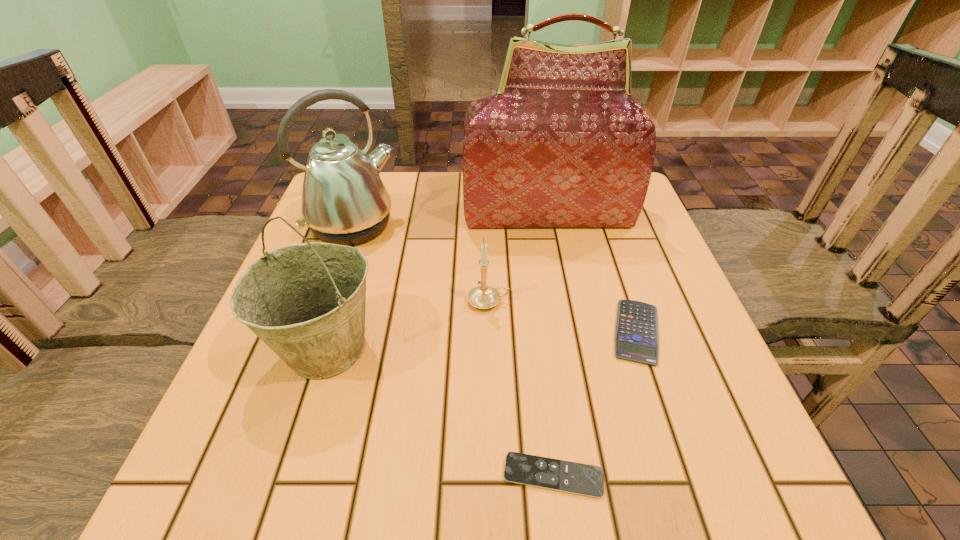
Identify the location of vacant space situated 0.060m on the right of the calculator. This screenshot has width=960, height=540. (697, 332).

In order to click on vacant area located on the back of the remote control in this screenshot , I will do `click(545, 406)`.

Locate an element on the screen. handbag at the far edge is located at coordinates pos(562,143).

Locate an element on the screen. This screenshot has width=960, height=540. kettle positioned at the far edge is located at coordinates (344, 201).

Where is `object present at the near edge`? This screenshot has width=960, height=540. object present at the near edge is located at coordinates [x=576, y=478].

Find the location of a particular element. kettle that is at the left edge is located at coordinates (344, 201).

You are a GUI agent. You are given a task and a screenshot of the screen. Output one action in this format:
    pyautogui.click(x=<x>, y=<y>)
    Task: Click on the wine bucket at the left edge
    The width and height of the screenshot is (960, 540).
    Given the screenshot: What is the action you would take?
    pyautogui.click(x=306, y=302)

Locate an element on the screen. handbag positioned at the right edge is located at coordinates (562, 143).

This screenshot has width=960, height=540. I want to click on calculator that is at the right edge, so click(636, 336).

At what (x,y) coordinates should I click in order to perform the action: click on object located at the far left corner. Please return your answer as a coordinate pair (x, y). The image size is (960, 540). Looking at the image, I should click on (344, 201).